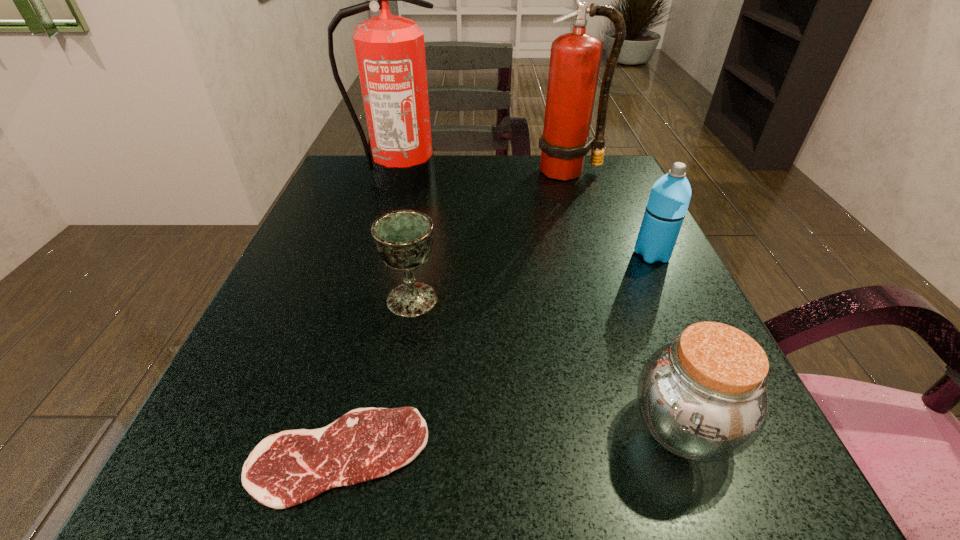
Find the location of a particular element. This screenshot has height=540, width=960. object that is at the far left corner is located at coordinates (390, 51).

This screenshot has height=540, width=960. I want to click on object that is at the near left corner, so click(x=285, y=469).

The height and width of the screenshot is (540, 960). Find the location of `object at the far right corner`. object at the far right corner is located at coordinates (575, 58).

Identify the location of object at the near right corner. (703, 397).

Where is `vacant space at the far edge of the desktop`? The image size is (960, 540). vacant space at the far edge of the desktop is located at coordinates (424, 195).

Where is `blank area at the left edge`? blank area at the left edge is located at coordinates click(269, 402).

In the image, there is a desktop. In order to click on free space at the right edge in this screenshot , I will do `click(772, 440)`.

You are a GUI agent. You are given a task and a screenshot of the screen. Output one action in this format:
    pyautogui.click(x=<x>, y=<y>)
    Task: Click on the vacant space at the far left corner of the desktop
    The width and height of the screenshot is (960, 540).
    Given the screenshot: What is the action you would take?
    click(x=355, y=156)

Where is `vacant space at the far right corner of the desktop`? The width and height of the screenshot is (960, 540). vacant space at the far right corner of the desktop is located at coordinates (587, 176).

In the image, there is a desktop. Where is `free region at the near right corner`? This screenshot has width=960, height=540. free region at the near right corner is located at coordinates (659, 481).